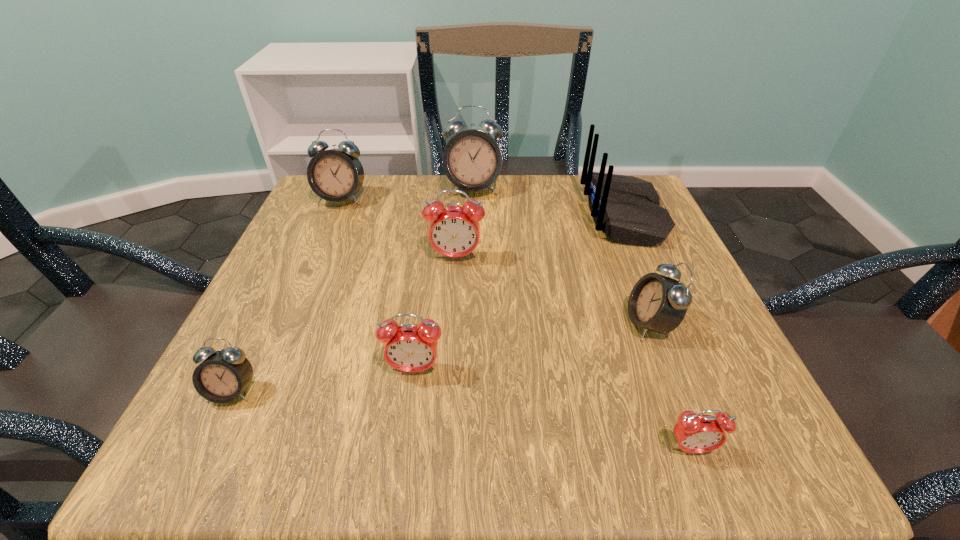
In order to click on vacant space situated 0.270m on the face of the second nearest white alarm clock in this screenshot , I will do [x=463, y=324].

The image size is (960, 540). Find the location of `vacant space located on the face of the smallest white alarm clock`. vacant space located on the face of the smallest white alarm clock is located at coordinates (202, 458).

Locate an element on the screen. The height and width of the screenshot is (540, 960). router located in the far edge section of the desktop is located at coordinates (627, 207).

The height and width of the screenshot is (540, 960). I want to click on router located in the right edge section of the desktop, so click(x=627, y=207).

Find the location of `object that is at the far left corner`. object that is at the far left corner is located at coordinates (335, 175).

Locate an element on the screen. The width and height of the screenshot is (960, 540). object that is at the near left corner is located at coordinates (224, 374).

At what (x,y) coordinates should I click in order to perform the action: click on object that is positioned at the far right corner. Please return your answer as a coordinate pair (x, y). This screenshot has height=540, width=960. Looking at the image, I should click on (627, 207).

The width and height of the screenshot is (960, 540). I want to click on object at the near right corner, so click(695, 433).

The image size is (960, 540). In order to click on vacant region at the far edge in this screenshot , I will do `click(405, 215)`.

Where is `vacant space at the near edge of the desktop`? This screenshot has width=960, height=540. vacant space at the near edge of the desktop is located at coordinates (543, 427).